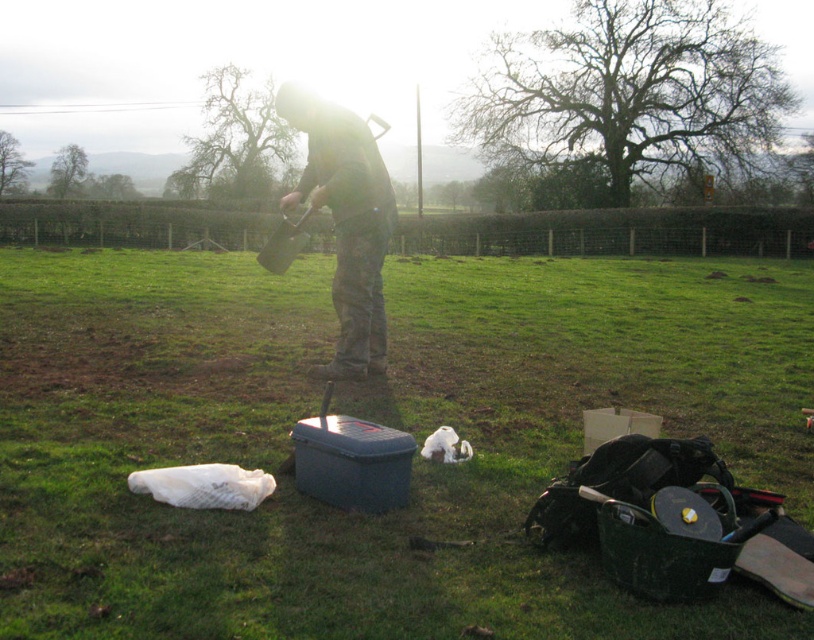
Describe the element at coordinates (375, 420) in the screenshot. This screenshot has width=814, height=640. I see `matte black tool box at center` at that location.

Is matte black tool box at center above camouflage fabric shirt at center?

Yes.

The image size is (814, 640). I want to click on matte black tool box at center, so click(375, 420).

Identify the location of matte black tool box at center. click(375, 420).